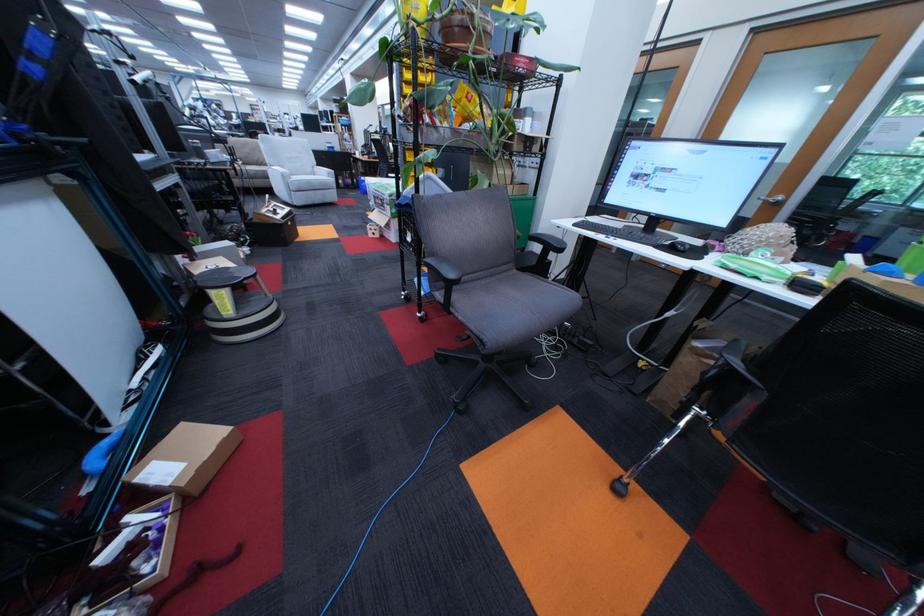
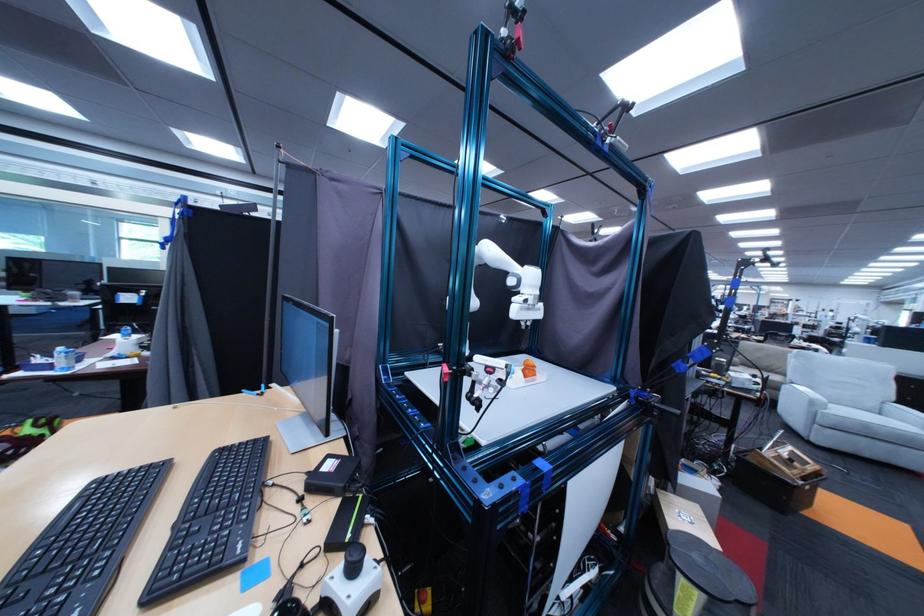
Question: The images are taken continuously from a first-person perspective. In which direction is your viewpoint rotating?

Choices:
 (A) Left
 (B) Right
 (C) Up
 (D) Down

Answer: (A)